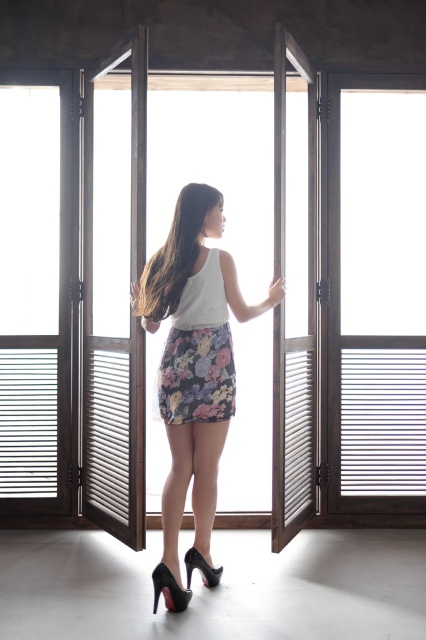
Who is taller, floral fabric skirt at center or black patent leather high-heeled shoe at lower center?

floral fabric skirt at center

Can you confirm if floral fabric skirt at center is shorter than black patent leather high-heeled shoe at lower center?

No.

Measure the distance between point (175, 326) and camera.

A distance of 11.57 feet exists between point (175, 326) and camera.

In order to click on floral fabric skirt at center in this screenshot , I will do `click(195, 356)`.

Between wooden slatted door at right and matte wooden window at left, which one is positioned lower?

wooden slatted door at right is below.

Can you confirm if wooden slatted door at right is positioned below matte wooden window at left?

Correct, wooden slatted door at right is located below matte wooden window at left.

Locate an element on the screen. Image resolution: width=426 pixels, height=640 pixels. wooden slatted door at right is located at coordinates (374, 292).

Is matte wooden window at left above floral-patterned fabric skirt at center?

Yes, matte wooden window at left is above floral-patterned fabric skirt at center.

Is point (14, 342) behind point (183, 298)?

Yes, it is.

In order to click on matte wooden window at left in this screenshot , I will do `click(34, 291)`.